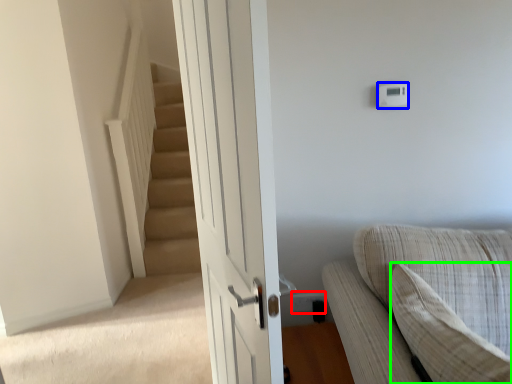
Question: Which is farther away from electric outlet (highlighted by a red box)? light switch (highlighted by a blue box) or pillow (highlighted by a green box)?

Choices:
 (A) light switch
 (B) pillow

Answer: (A)